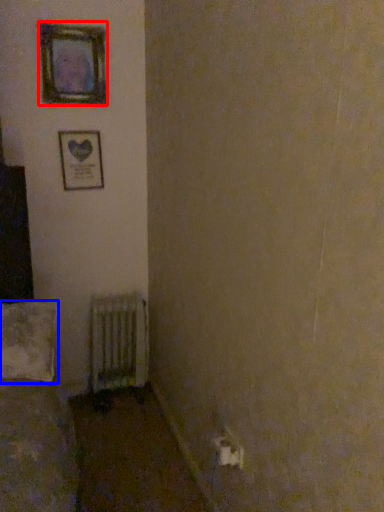
Question: Which object is further to the camera taking this photo, picture frame (highlighted by a red box) or pillow (highlighted by a blue box)?

Choices:
 (A) picture frame
 (B) pillow

Answer: (A)